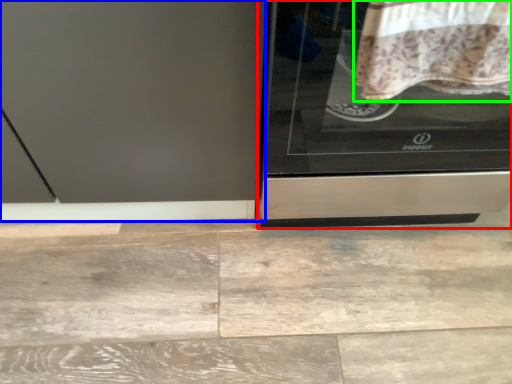
Question: Considering the real-world distances, which object is closest to home appliance (highlighted by a red box)? screen door (highlighted by a blue box) or blanket (highlighted by a green box).

Choices:
 (A) screen door
 (B) blanket

Answer: (B)